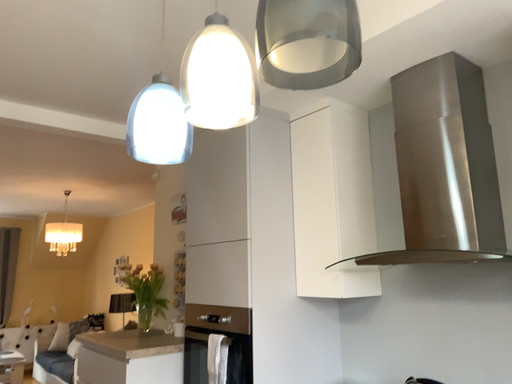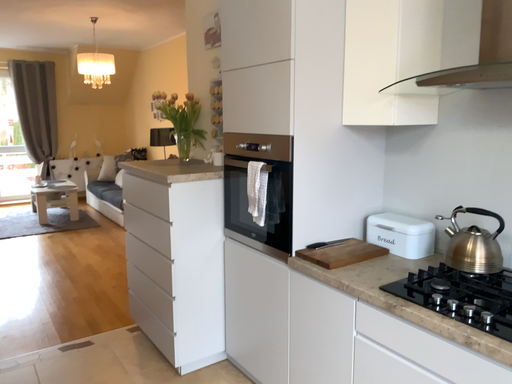
Question: How did the camera likely rotate when shooting the video?

Choices:
 (A) rotated upward
 (B) rotated downward

Answer: (B)